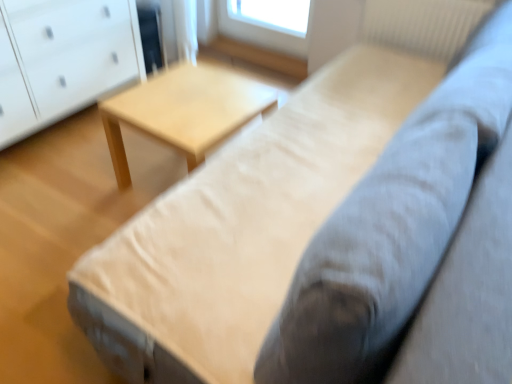
Question: In the image, is light wood table at center positioned in front of or behind white glossy chest of drawers at left?

Choices:
 (A) behind
 (B) front

Answer: (B)

Question: In the image, is light wood table at center on the left side or the right side of white glossy chest of drawers at left?

Choices:
 (A) left
 (B) right

Answer: (B)

Question: Which is nearer to the white glossy chest of drawers at left?

Choices:
 (A) light wood table at center
 (B) white textured radiator at upper right

Answer: (A)

Question: Which of these objects is positioned farthest from the white glossy chest of drawers at left?

Choices:
 (A) white textured radiator at upper right
 (B) light wood table at center

Answer: (A)